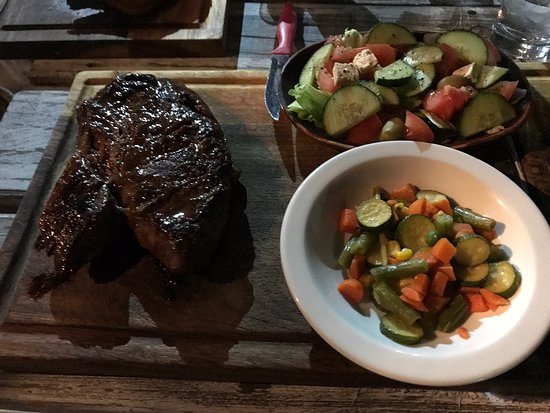
Locate an element on the screen. This screenshot has width=550, height=413. table is located at coordinates (27, 118).